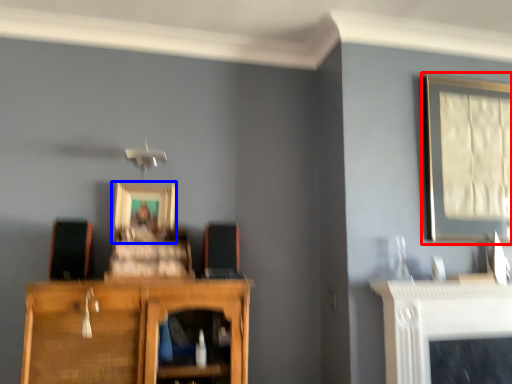
Question: Which of the following is the farthest to the observer, picture frame (highlighted by a red box) or picture frame (highlighted by a blue box)?

Choices:
 (A) picture frame
 (B) picture frame

Answer: (B)